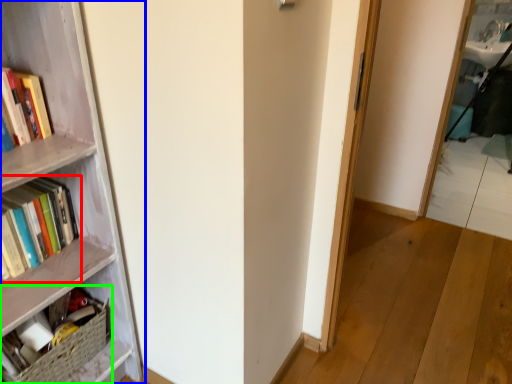
Question: Which object is positioned farthest from book (highlighted by a red box)? Select from bookcase (highlighted by a blue box) and book (highlighted by a green box).

Choices:
 (A) bookcase
 (B) book

Answer: (B)